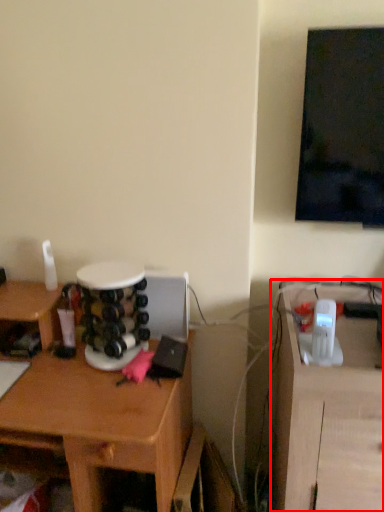
Question: From the image's perspective, where is computer desk (annotated by the red box) located in relation to desk in the image?

Choices:
 (A) above
 (B) below

Answer: (B)